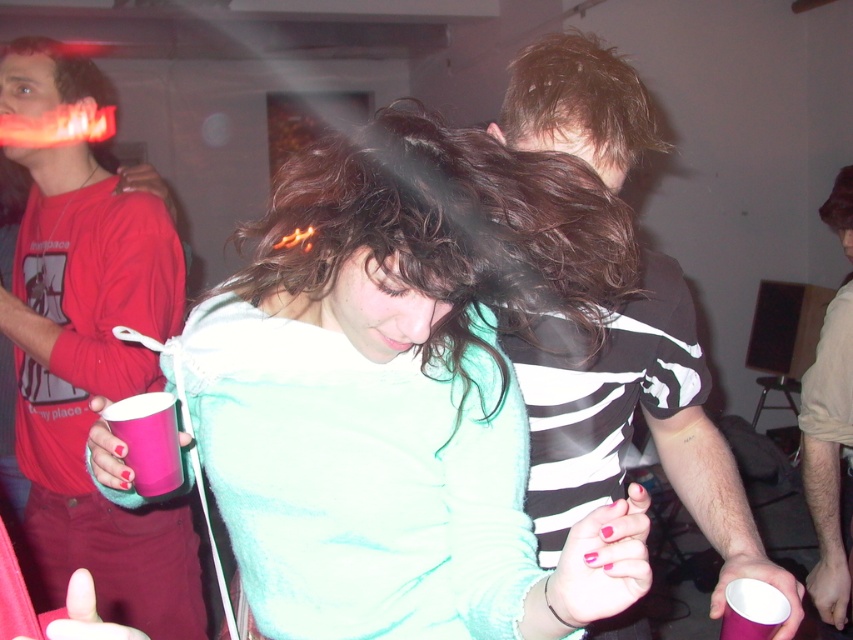
Is point (132, 317) in front of point (827, 518)?

Yes, it is in front of point (827, 518).

Which is above, matte red shirt at left or brown fuzzy hat at upper center?

matte red shirt at left is above.

What do you see at coordinates (94, 384) in the screenshot?
I see `matte red shirt at left` at bounding box center [94, 384].

This screenshot has height=640, width=853. What are the coordinates of `matte red shirt at left` in the screenshot? It's located at (94, 384).

Which is below, matte red shirt at left or pink plastic cup at lower left?

Positioned lower is pink plastic cup at lower left.

Is the position of matte red shirt at left less distant than that of pink plastic cup at lower left?

No, it is not.

Who is more distant from viewer, [144,241] or [126,435]?

Positioned behind is point [144,241].

At what (x,y) coordinates should I click in order to perform the action: click on matte red shirt at left. Please return your answer as a coordinate pair (x, y). Looking at the image, I should click on (94, 384).

Which of these two, brown fuzzy hat at upper center or pink paper cup at lower right, stands shorter?

pink paper cup at lower right

Where is `brown fuzzy hat at upper center`? The height and width of the screenshot is (640, 853). brown fuzzy hat at upper center is located at coordinates (828, 456).

Where is `brown fuzzy hat at upper center`? brown fuzzy hat at upper center is located at coordinates (828, 456).

The image size is (853, 640). In order to click on brown fuzzy hat at upper center in this screenshot , I will do `click(828, 456)`.